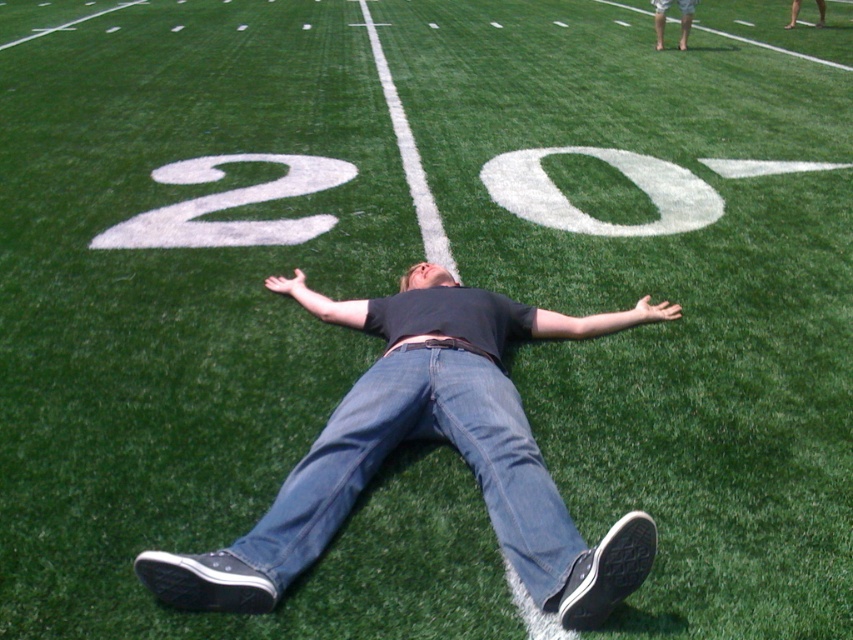
Question: Does denim at center have a larger size compared to matte black belt at center?

Choices:
 (A) no
 (B) yes

Answer: (B)

Question: Which point appears farthest from the camera in this image?

Choices:
 (A) (561, 572)
 (B) (283, 522)
 (C) (421, 344)

Answer: (C)

Question: Can you confirm if denim at center is thinner than matte black belt at center?

Choices:
 (A) yes
 (B) no

Answer: (B)

Question: Which point appears closest to the camera in this image?

Choices:
 (A) (419, 342)
 (B) (640, 312)

Answer: (A)

Question: Estimate the real-world distances between objects in this image. Which object is closer to the matte black belt at center?

Choices:
 (A) smooth skin legs at upper right
 (B) denim jeans at center
 (C) white painted number at center

Answer: (B)

Question: Does white painted number at center have a larger size compared to matte black belt at center?

Choices:
 (A) no
 (B) yes

Answer: (B)